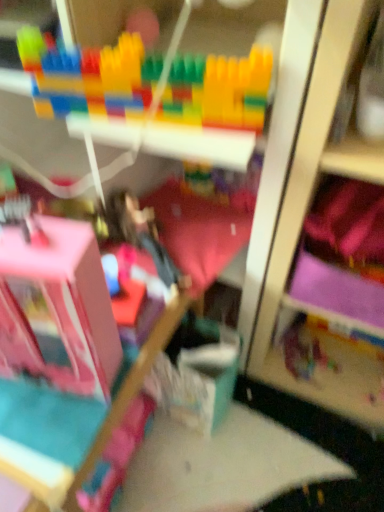
Question: Relative to pink fabric bed frame at lower left, is translucent plastic toy at center, the 3th toy when ordered from front to back, in front or behind?

Choices:
 (A) front
 (B) behind

Answer: (B)

Question: Is translucent plastic toy at center, the 3th toy when ordered from front to back, wider or thinner than pink fabric bed frame at lower left?

Choices:
 (A) thin
 (B) wide

Answer: (A)

Question: Which is farther from the multicolored plastic blocks at upper center, arranged as the 2th toy when viewed from the left?

Choices:
 (A) translucent plastic toy at center, arranged as the 1th toy when ordered from the bottom
 (B) pink plastic dollhouse at lower left, placed as the 2th toy when sorted from top to bottom
 (C) pink fabric bed frame at lower left
 (D) pink fabric bedding at center

Answer: (A)

Question: Which of these objects is positioned farthest from the multicolored plastic blocks at upper center, positioned as the 2th toy in front-to-back order?

Choices:
 (A) translucent plastic toy at center, the third toy from the left
 (B) pink fabric bedding at center
 (C) pink fabric bed frame at lower left
 (D) pink plastic dollhouse at lower left, the third toy when ordered from back to front

Answer: (A)